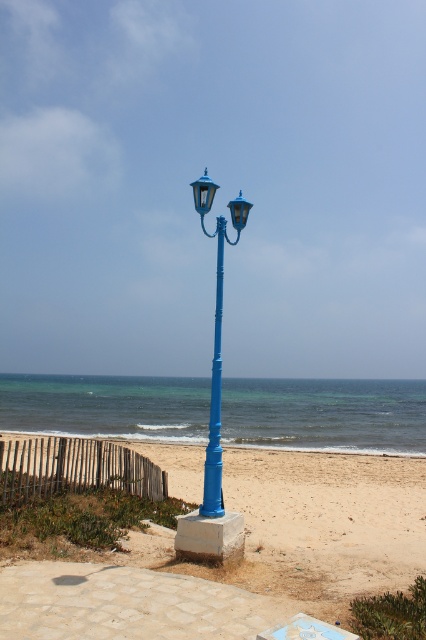
Locate an element on the screen. blue polished metal street light at center is located at coordinates (215, 339).

You are a GUI agent. You are given a task and a screenshot of the screen. Output one action in this format:
    pyautogui.click(x=<x>, y=<y>)
    Task: Click on the blue polished metal street light at center
    The width and height of the screenshot is (426, 640).
    Given the screenshot: What is the action you would take?
    pyautogui.click(x=215, y=339)

Between smooth sand at center and blue painted metal pole at center, which one has more height?

smooth sand at center

Does smooth sand at center have a greater height compared to blue painted metal pole at center?

Correct, smooth sand at center is much taller as blue painted metal pole at center.

Where is `smooth sand at center`? smooth sand at center is located at coordinates (245, 556).

Is smooth sand at center to the left of blue polished metal street light at center from the viewer's perspective?

Incorrect, smooth sand at center is not on the left side of blue polished metal street light at center.

Can you confirm if smooth sand at center is positioned to the right of blue polished metal street light at center?

Yes, smooth sand at center is to the right of blue polished metal street light at center.

Who is more forward, [333,481] or [219,320]?

Positioned in front is point [219,320].

Identify the location of smooth sand at center. The height and width of the screenshot is (640, 426). (245, 556).